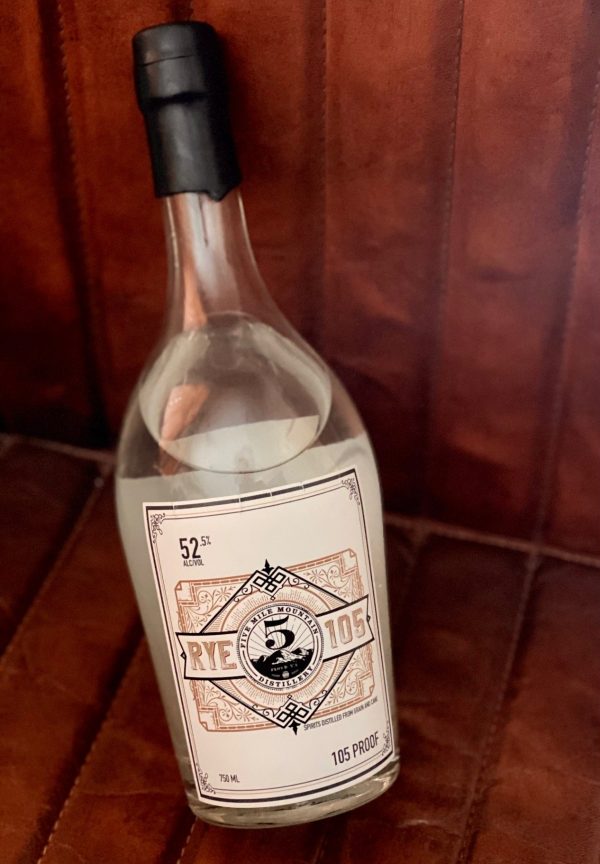
Where is `bottle`? The width and height of the screenshot is (600, 864). bottle is located at coordinates (245, 435).